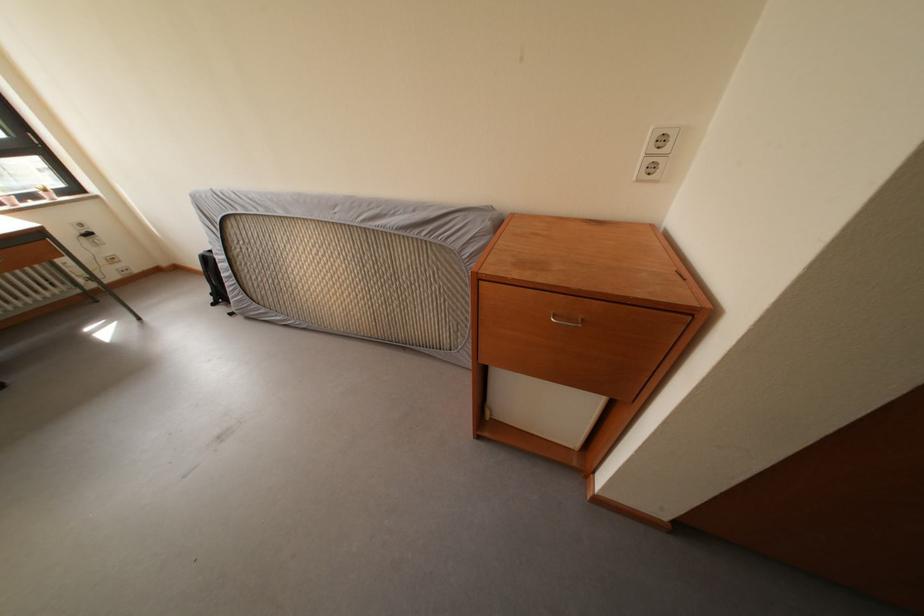
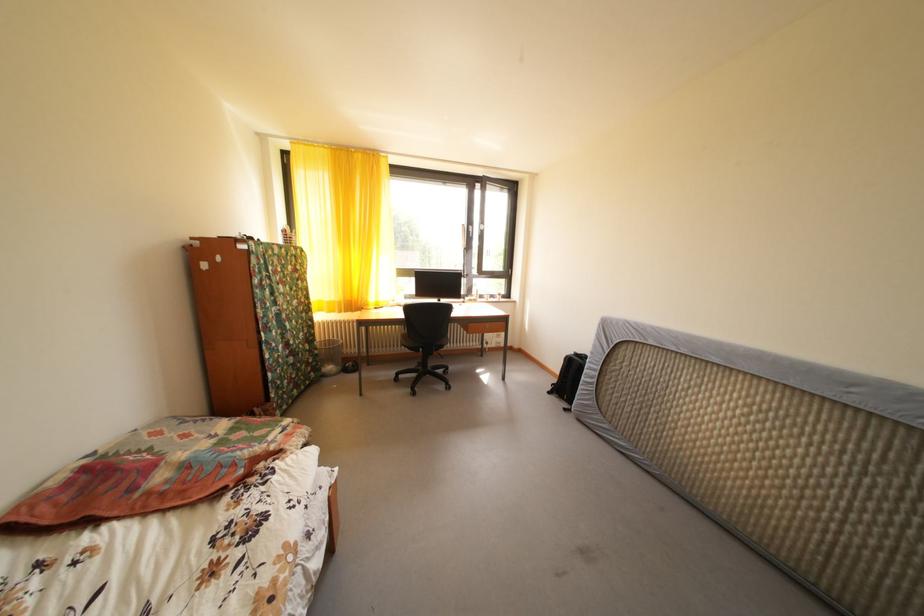
Question: The images are taken continuously from a first-person perspective. In which direction is your viewpoint rotating?

Choices:
 (A) Left
 (B) Right
 (C) Up
 (D) Down

Answer: (A)